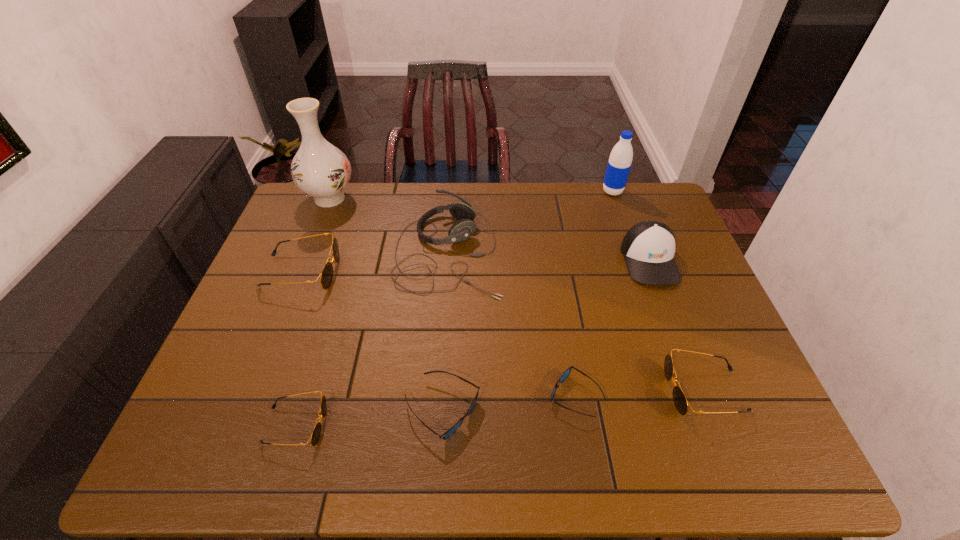
Locate an element on the screen. The width and height of the screenshot is (960, 540). empty location between the headset and the left blue sunglasses is located at coordinates point(445,331).

Identify the location of free spot between the bigger blue sunglasses and the smallest black sunglasses. Image resolution: width=960 pixels, height=540 pixels. (369, 417).

Point out which object is positioned as the fourth nearest to the headset. Please provide its 2D coordinates. Your answer should be formatted as a tuple, i.e. [(x, y)], where the tuple contains the x and y coordinates of a point satisfying the conditions above.

[(567, 372)]

The width and height of the screenshot is (960, 540). Find the location of `object that is the fourth closest one to the farthest black sunglasses`. object that is the fourth closest one to the farthest black sunglasses is located at coordinates (453, 429).

Where is `sunglasses that is the third closest to the gray cap`? Image resolution: width=960 pixels, height=540 pixels. sunglasses that is the third closest to the gray cap is located at coordinates (453, 429).

At what (x,y) coordinates should I click in order to perform the action: click on sunglasses identified as the fifth closest to the gray cap. Please return your answer as a coordinate pair (x, y). The height and width of the screenshot is (540, 960). Looking at the image, I should click on (326, 276).

I want to click on black sunglasses that is the second closest to the rightmost black sunglasses, so click(x=326, y=276).

Identify the location of black sunglasses that can be found as the closest to the fifth tallest object. The height and width of the screenshot is (540, 960). (316, 432).